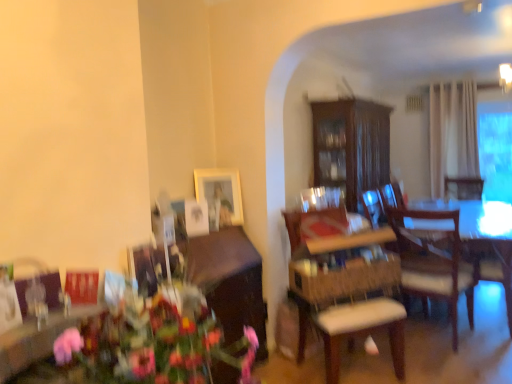
This screenshot has height=384, width=512. Identify the location of blank area to the left of wooden armchair at right. (434, 322).